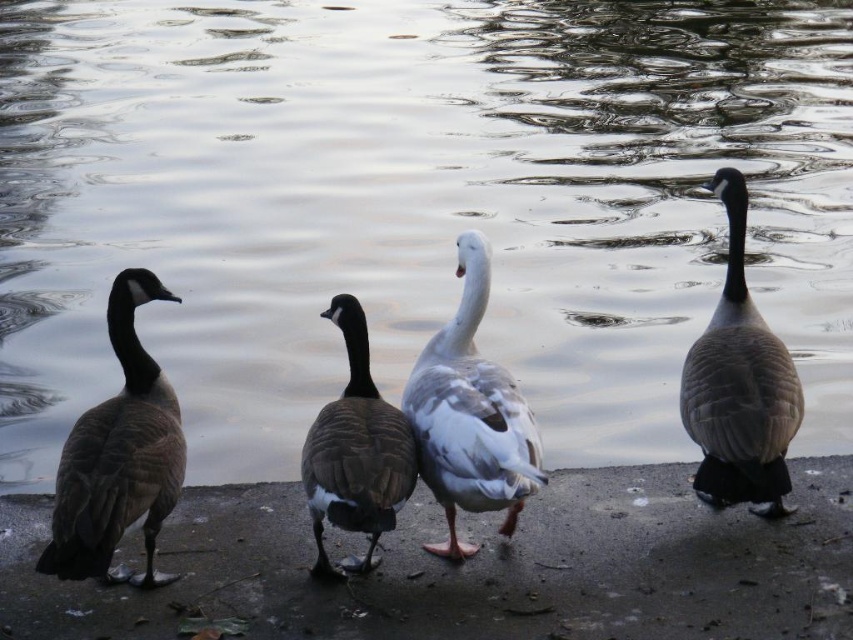
Question: Observing the image, what is the correct spatial positioning of gray concrete sidewalk at lower center in reference to brown feathered goose at right?

Choices:
 (A) right
 (B) left

Answer: (B)

Question: Among these points, which one is farthest from the camera?

Choices:
 (A) (773, 524)
 (B) (401, 449)

Answer: (A)

Question: Which object appears farthest from the camera in this image?

Choices:
 (A) brown matte duck at center
 (B) white matte duck at center
 (C) gray concrete sidewalk at lower center

Answer: (C)

Question: Is brown feathered goose at right smaller than brown matte duck at center?

Choices:
 (A) yes
 (B) no

Answer: (B)

Question: Which object is closer to the camera taking this photo?

Choices:
 (A) white matte duck at center
 (B) gray concrete sidewalk at lower center
 (C) brown feathered goose at right

Answer: (A)

Question: Does gray concrete sidewalk at lower center have a larger size compared to brown feathered goose at right?

Choices:
 (A) yes
 (B) no

Answer: (A)